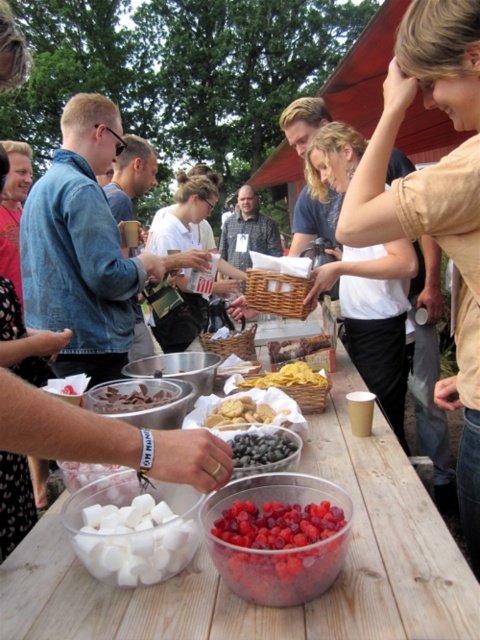
Question: Is white matte shirt at center thinner than shiny dark blue grapes at center?

Choices:
 (A) no
 (B) yes

Answer: (A)

Question: Does translucent plastic bowl of cherries at center lie in front of golden crumbly cookies at center?

Choices:
 (A) no
 (B) yes

Answer: (B)

Question: Which point is farther to the camera?

Choices:
 (A) shiny dark blue grapes at center
 (B) white matte marshmallows at lower left
 (C) clear plastic bowls at center
 (D) translucent plastic bowl of cherries at center

Answer: (A)

Question: Is clear plastic bowls at center positioned before translucent plastic bowl of cherries at center?

Choices:
 (A) no
 (B) yes

Answer: (B)

Question: Based on their relative distances, which object is nearer to the translucent plastic bowl of cherries at center?

Choices:
 (A) golden crumbly cookies at center
 (B) white matte marshmallows at lower left

Answer: (B)

Question: Which point is farther from the camera taking this photo?

Choices:
 (A) (300, 384)
 (B) (55, 522)

Answer: (A)